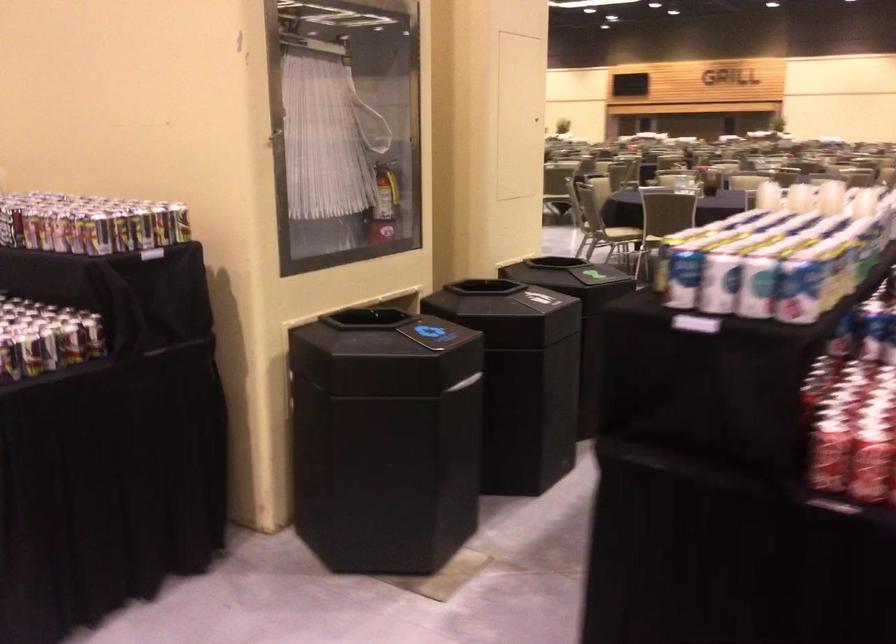
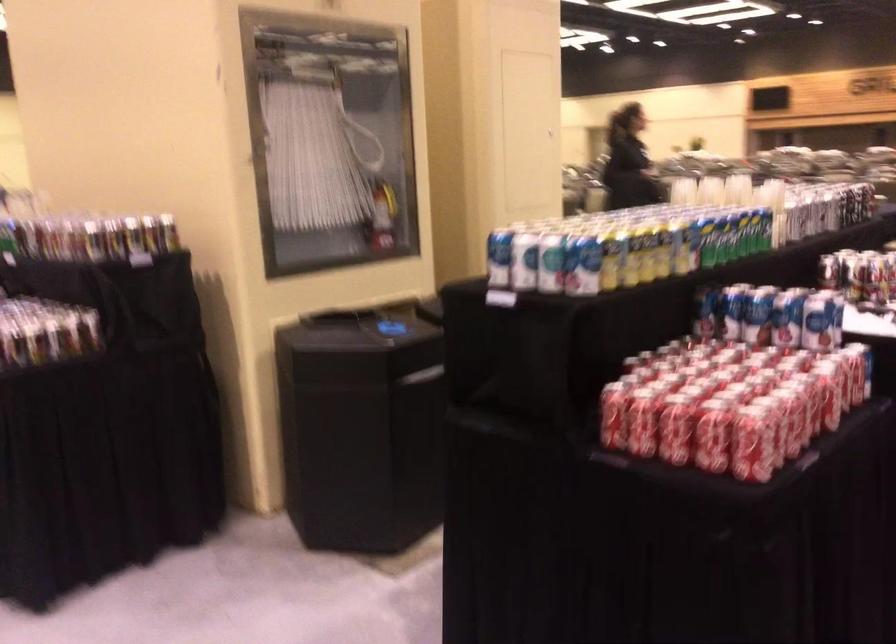
In the second image, find the point that corresponds to the point at 383,203 in the first image.

(382, 216)